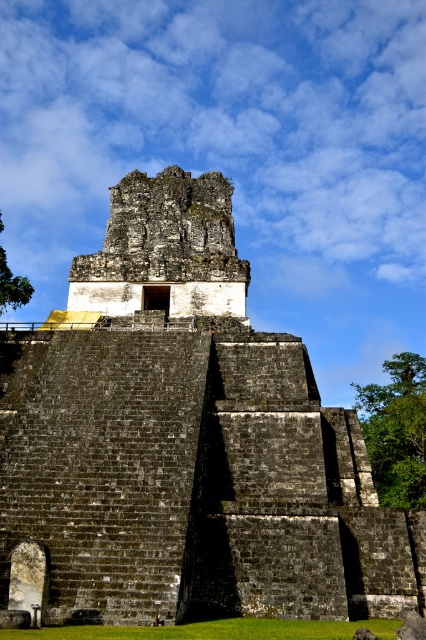
You are standing at the base of the ancient stone structure and want to take a photo of the point at coordinates point [391,547]. Your camera has a maximum zoom range of 50 meters. Will you be able to capture the point in your photo?

The distance of point [391,547] from viewer is 46.30 meters, so yes, the camera can capture the point since its maximum zoom range of 50 meters is greater than the distance to the point.

You are a tour guide standing at the base of the dark gray stone ruins at center. You want to inform visitors about the historical significance of the ruins. Considering the distance between you and the ruins, can you clearly point out specific details of the ruins to the visitors?

The dark gray stone ruins at center are 37.24 meters away from you, so you can clearly point out specific details like the intricate carvings on the tower facade and the weathered stonework to the visitors.